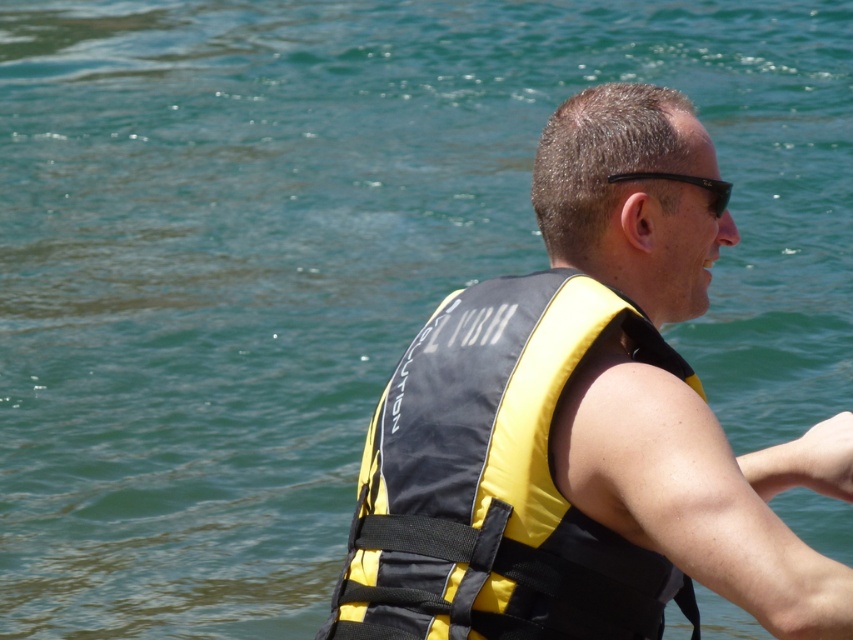
Does yellow/black life vest at center have a larger size compared to black matte sunglasses at upper center?

Yes, yellow/black life vest at center is bigger than black matte sunglasses at upper center.

Does yellow/black life vest at center have a greater height compared to black matte sunglasses at upper center?

Yes, yellow/black life vest at center is taller than black matte sunglasses at upper center.

Is point (547, 566) closer to camera compared to point (717, 193)?

Yes.

Image resolution: width=853 pixels, height=640 pixels. Identify the location of yellow/black life vest at center. tap(583, 426).

Identify the location of yellow fabric life jacket at center. (498, 477).

Between point (538, 321) and point (607, 176), which one is positioned in front?

Positioned in front is point (538, 321).

This screenshot has height=640, width=853. Find the location of `yellow fabric life jacket at center`. yellow fabric life jacket at center is located at coordinates (498, 477).

Is yellow/black life vest at center above yellow fabric life jacket at center?

Yes.

Is yellow/black life vest at center to the left of yellow fabric life jacket at center from the viewer's perspective?

In fact, yellow/black life vest at center is to the right of yellow fabric life jacket at center.

Does point (666, 513) lie behind point (520, 506)?

No, (666, 513) is in front of (520, 506).

Image resolution: width=853 pixels, height=640 pixels. Identify the location of yellow/black life vest at center. (583, 426).